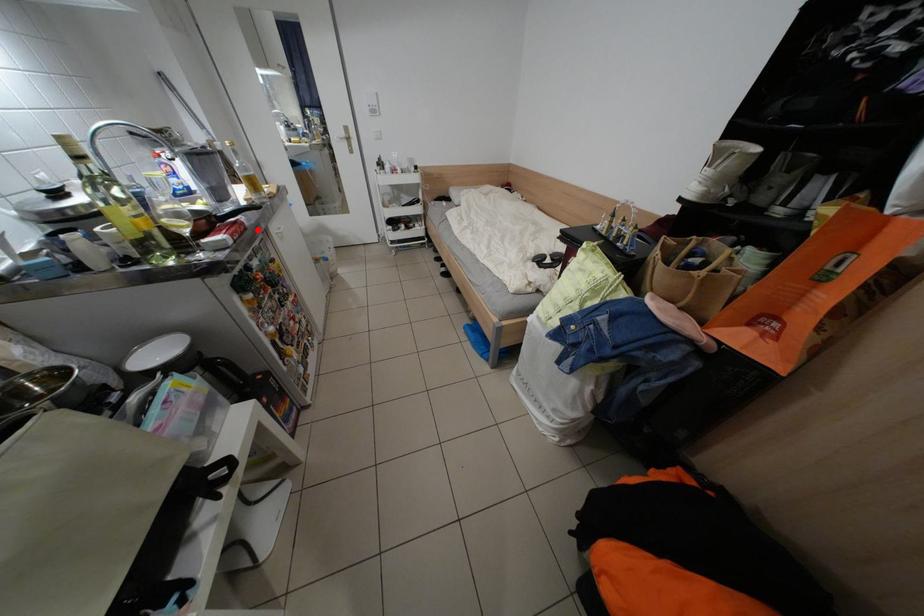
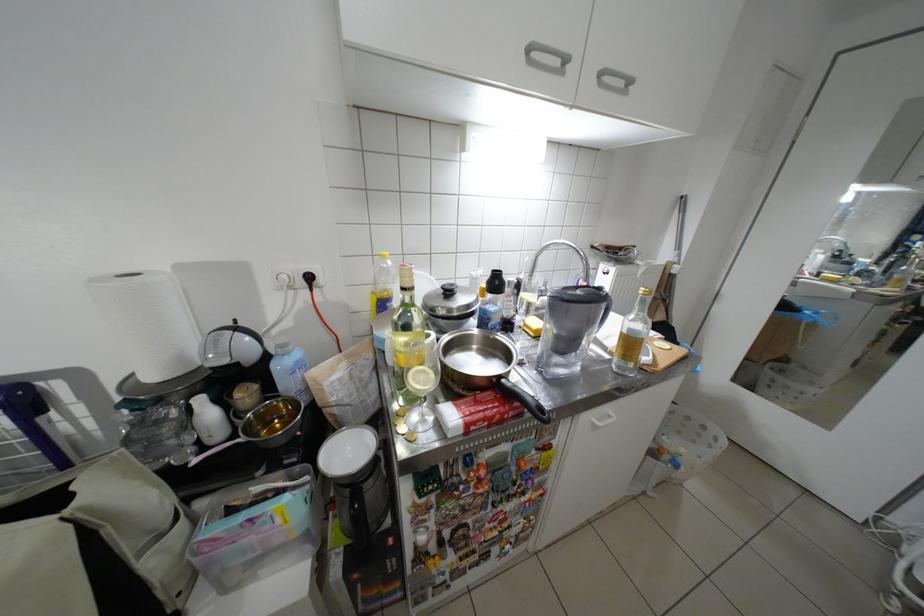
Question: I am providing you with two images of the same scene from different viewpoints. Image1 has a red point marked. In image2, the corresponding 3D location appears at what relative position? Reply with the corresponding letter.

Choices:
 (A) Closer
 (B) Farther

Answer: (B)